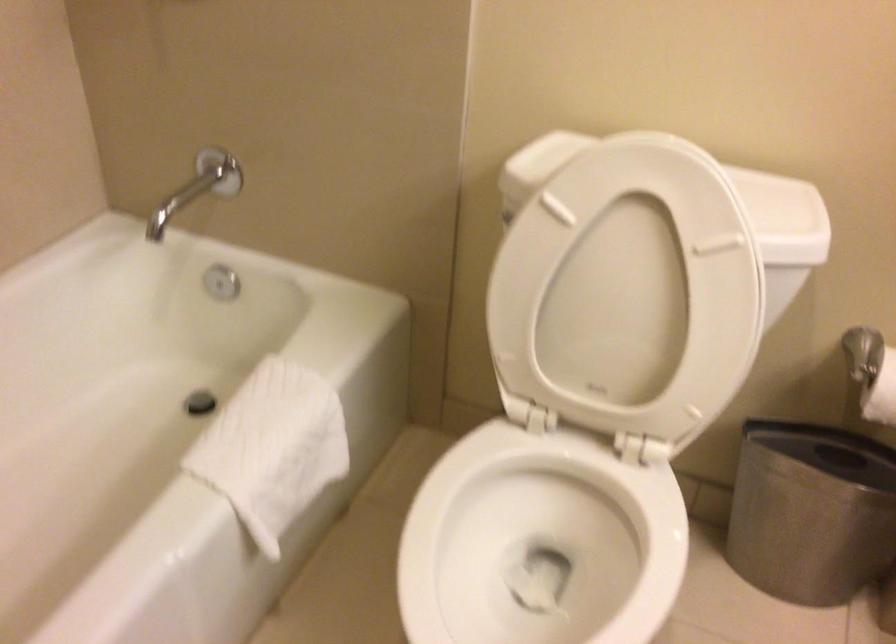
The image size is (896, 644). What do you see at coordinates (633, 285) in the screenshot? I see `a white toilet lid` at bounding box center [633, 285].